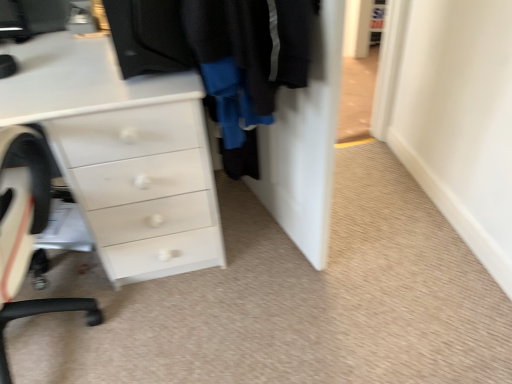
Question: Can you confirm if white glossy chest of drawers at center is smaller than white plastic chair at left?

Choices:
 (A) no
 (B) yes

Answer: (A)

Question: Does white glossy chest of drawers at center have a larger size compared to white plastic chair at left?

Choices:
 (A) yes
 (B) no

Answer: (A)

Question: Is white glossy chest of drawers at center wider than white plastic chair at left?

Choices:
 (A) no
 (B) yes

Answer: (A)

Question: Is white glossy chest of drawers at center not near white plastic chair at left?

Choices:
 (A) no
 (B) yes

Answer: (A)

Question: From a real-world perspective, does white glossy chest of drawers at center stand above white plastic chair at left?

Choices:
 (A) no
 (B) yes

Answer: (A)

Question: Is white glossy chest of drawers at center situated inside white plastic chair at left or outside?

Choices:
 (A) outside
 (B) inside

Answer: (A)

Question: From their relative heights in the image, would you say white glossy chest of drawers at center is taller or shorter than white plastic chair at left?

Choices:
 (A) short
 (B) tall

Answer: (A)

Question: Based on their positions, is white glossy chest of drawers at center located to the left or right of white plastic chair at left?

Choices:
 (A) left
 (B) right

Answer: (B)

Question: In terms of width, does white glossy chest of drawers at center look wider or thinner when compared to white plastic chair at left?

Choices:
 (A) wide
 (B) thin

Answer: (B)

Question: Does point (287, 230) appear closer or farther from the camera than point (7, 261)?

Choices:
 (A) farther
 (B) closer

Answer: (A)

Question: From a real-world perspective, is black fabric door at center above or below white plastic chair at left?

Choices:
 (A) above
 (B) below

Answer: (B)

Question: Based on their sizes in the image, would you say black fabric door at center is bigger or smaller than white plastic chair at left?

Choices:
 (A) small
 (B) big

Answer: (A)

Question: Do you think black fabric door at center is within white plastic chair at left, or outside of it?

Choices:
 (A) outside
 (B) inside

Answer: (A)

Question: From a real-world perspective, is white glossy chest of drawers at center positioned above or below black fabric door at center?

Choices:
 (A) below
 (B) above

Answer: (A)

Question: Is white glossy chest of drawers at center taller or shorter than black fabric door at center?

Choices:
 (A) short
 (B) tall

Answer: (A)